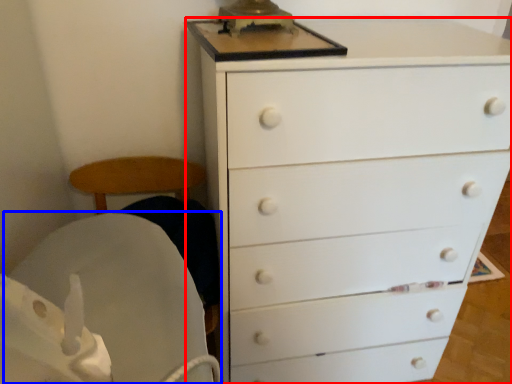
Question: Among these objects, which one is nearest to the camera, chest of drawers (highlighted by a red box) or rocking chair (highlighted by a blue box)?

Choices:
 (A) chest of drawers
 (B) rocking chair

Answer: (A)